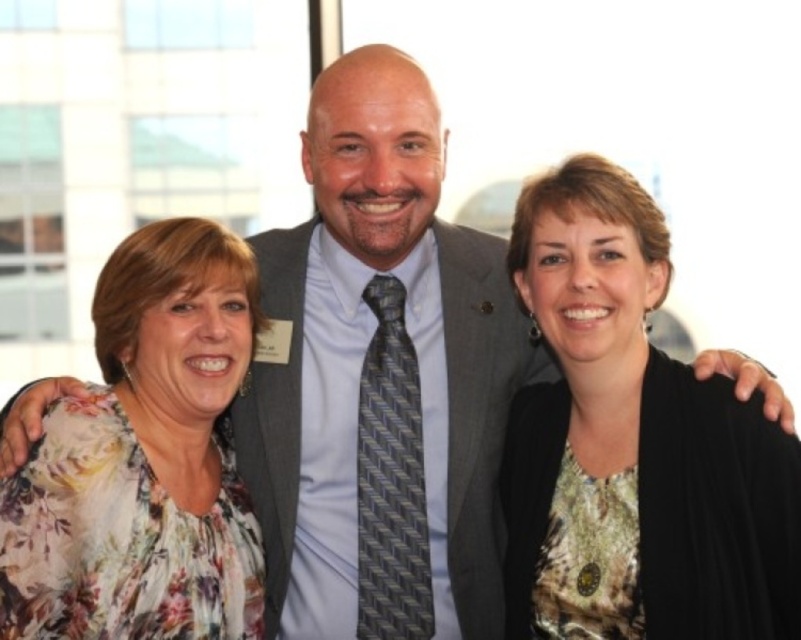
Is point (667, 406) positioned after point (107, 296)?

No, (667, 406) is in front of (107, 296).

What do you see at coordinates (634, 442) in the screenshot?
I see `floral fabric blouse at center` at bounding box center [634, 442].

Locate an element on the screen. floral fabric blouse at center is located at coordinates (634, 442).

Does floral fabric blouse at center have a lesser width compared to gray textured suit at center?

No.

Is point (702, 412) farther from viewer compared to point (473, 566)?

No, it is in front of (473, 566).

Image resolution: width=801 pixels, height=640 pixels. I want to click on floral fabric blouse at center, so click(634, 442).

This screenshot has height=640, width=801. What are the coordinates of `floral fabric blouse at left` in the screenshot? It's located at (182, 376).

Does point (131, 364) come farther from viewer compared to point (274, 561)?

No, (131, 364) is closer to viewer.

This screenshot has width=801, height=640. In order to click on floral fabric blouse at left in this screenshot , I will do `click(182, 376)`.